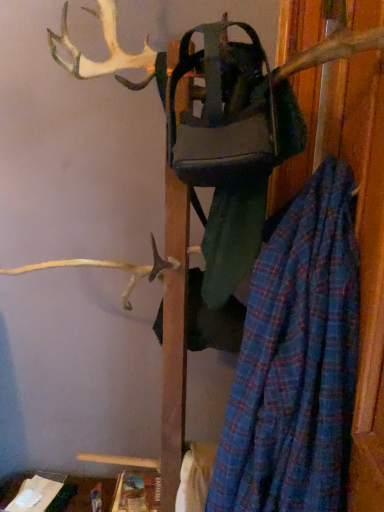
The height and width of the screenshot is (512, 384). Describe the element at coordinates (296, 360) in the screenshot. I see `blue plaid umbrella at right` at that location.

What is the approximate width of blue plaid umbrella at right?

blue plaid umbrella at right is 13.44 inches wide.

Where is `blue plaid umbrella at right`? The width and height of the screenshot is (384, 512). blue plaid umbrella at right is located at coordinates tap(296, 360).

Where is `blue plaid umbrella at right`? This screenshot has width=384, height=512. blue plaid umbrella at right is located at coordinates (296, 360).